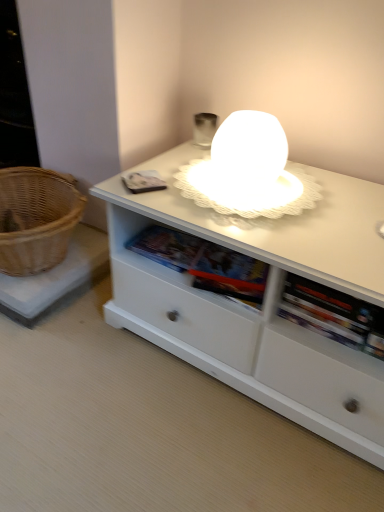
Question: Could you tell me if white matte cabinet at center is turned towards woven brown basket at left?

Choices:
 (A) no
 (B) yes

Answer: (A)

Question: Is white matte cabinet at center behind woven brown basket at left?

Choices:
 (A) no
 (B) yes

Answer: (A)

Question: Are white matte cabinet at center and woven brown basket at left located far from each other?

Choices:
 (A) no
 (B) yes

Answer: (A)

Question: Is white matte cabinet at center taller than woven brown basket at left?

Choices:
 (A) yes
 (B) no

Answer: (B)

Question: Does white matte cabinet at center touch woven brown basket at left?

Choices:
 (A) no
 (B) yes

Answer: (A)

Question: Is white matte cabinet at center bigger than woven brown basket at left?

Choices:
 (A) yes
 (B) no

Answer: (A)

Question: Is woven brown basket at left to the left of white matte cabinet at center from the viewer's perspective?

Choices:
 (A) yes
 (B) no

Answer: (A)

Question: Does woven brown basket at left lie in front of white matte cabinet at center?

Choices:
 (A) no
 (B) yes

Answer: (A)

Question: Considering the relative sizes of woven brown basket at left and white matte cabinet at center in the image provided, is woven brown basket at left thinner than white matte cabinet at center?

Choices:
 (A) no
 (B) yes

Answer: (B)

Question: From the image's perspective, would you say woven brown basket at left is positioned over white matte cabinet at center?

Choices:
 (A) no
 (B) yes

Answer: (B)

Question: From the image's perspective, does woven brown basket at left appear lower than white matte cabinet at center?

Choices:
 (A) yes
 (B) no

Answer: (B)

Question: From a real-world perspective, is woven brown basket at left beneath white matte cabinet at center?

Choices:
 (A) yes
 (B) no

Answer: (B)

Question: Based on their sizes in the image, would you say white matte cabinet at center is bigger or smaller than woven brown basket at left?

Choices:
 (A) small
 (B) big

Answer: (B)